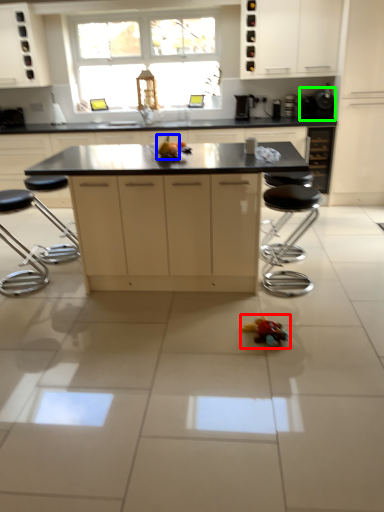
Question: Considering the real-world distances, which object is closest to toy (highlighted by a red box)? food (highlighted by a blue box) or appliance (highlighted by a green box).

Choices:
 (A) food
 (B) appliance

Answer: (A)